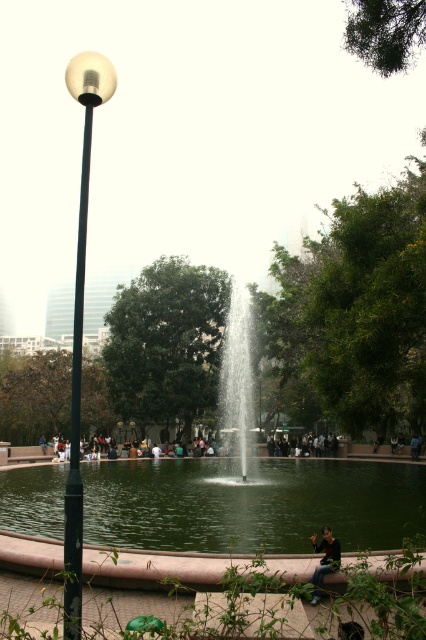
You are standing at the center of the park and want to locate the clear water fountain at center. Based on the coordinates provided, in which direction should you move to reach it?

The clear water fountain at center is located at coordinates point (238,384). Since you are at the center of the park, you should move towards the right slightly to reach it because the x coordinate 0.600 is to the right of the center point.

You are a photographer aiming to capture the fountain in the urban park. You notice the green liquid water at center and dark blue jeans at center in your shot. Which object appears taller in the frame?

The green liquid water at center appears taller than the dark blue jeans at center in the frame.

You are a photographer aiming to capture the clear water fountain at center without the dark green fabric jacket at lower center blocking the view. Based on their positions, is this possible?

The clear water fountain at center is located below the dark green fabric jacket at lower center, so it is partially obscured. To capture the fountain without obstruction, you would need to adjust your angle or position to avoid the jacket.